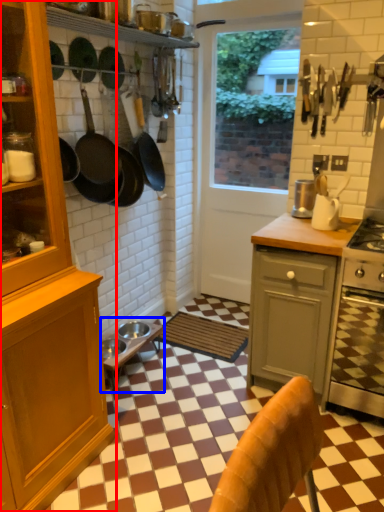
Question: Which point is closer to the camera, cabinetry (highlighted by a red box) or table (highlighted by a blue box)?

Choices:
 (A) cabinetry
 (B) table

Answer: (A)